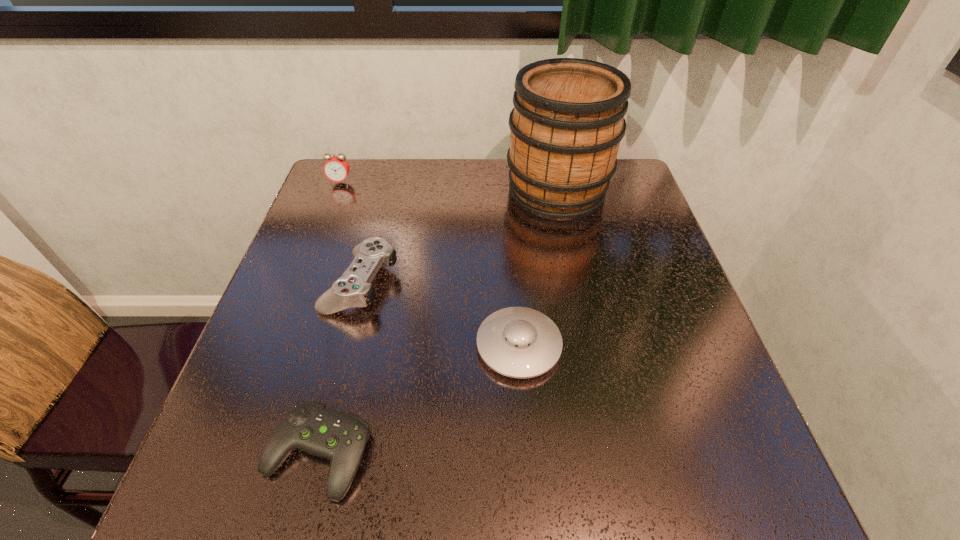
Where is `empty space that is in between the nearer control and the fourth shortest object`? empty space that is in between the nearer control and the fourth shortest object is located at coordinates (329, 318).

Find the location of `free spot between the cider and the second tallest object`. free spot between the cider and the second tallest object is located at coordinates (448, 187).

Identify the location of empty location between the fourth tallest object and the leftmost object. (429, 264).

Where is `vacant point located between the saucer and the shorter control`? Image resolution: width=960 pixels, height=540 pixels. vacant point located between the saucer and the shorter control is located at coordinates (419, 400).

You are a GUI agent. You are given a task and a screenshot of the screen. Output one action in this format:
    pyautogui.click(x=<x>, y=<y>)
    Task: Click on the object that is the closest to the shorter control
    This screenshot has height=540, width=960.
    Given the screenshot: What is the action you would take?
    pyautogui.click(x=518, y=342)

Locate an element on the screen. This screenshot has width=960, height=540. the fourth closest object to the third shortest object is located at coordinates (568, 120).

Identify the location of vacant space that satisfies the following two spatial constraints: 1. on the front-facing side of the tallest object; 2. on the left side of the alarm clock. (336, 192).

You are a GUI agent. You are given a task and a screenshot of the screen. Output one action in this format:
    pyautogui.click(x=<x>, y=<y>)
    Task: Click on the vacant point that satisfies the following two spatial constraints: 1. on the front-facing side of the second tallest object; 2. on the right side of the cider
    The image size is (960, 540).
    Given the screenshot: What is the action you would take?
    pyautogui.click(x=336, y=192)

At what (x,y) coordinates should I click in order to perform the action: click on vacant region that satisfies the following two spatial constraints: 1. on the front-facing side of the second tallest object; 2. on the left side of the third shortest object. Please return your answer as a coordinate pair (x, y). The width and height of the screenshot is (960, 540). Looking at the image, I should click on (301, 283).

The image size is (960, 540). I want to click on free region that satisfies the following two spatial constraints: 1. on the front-facing side of the second tallest object; 2. on the right side of the third shortest object, so click(301, 283).